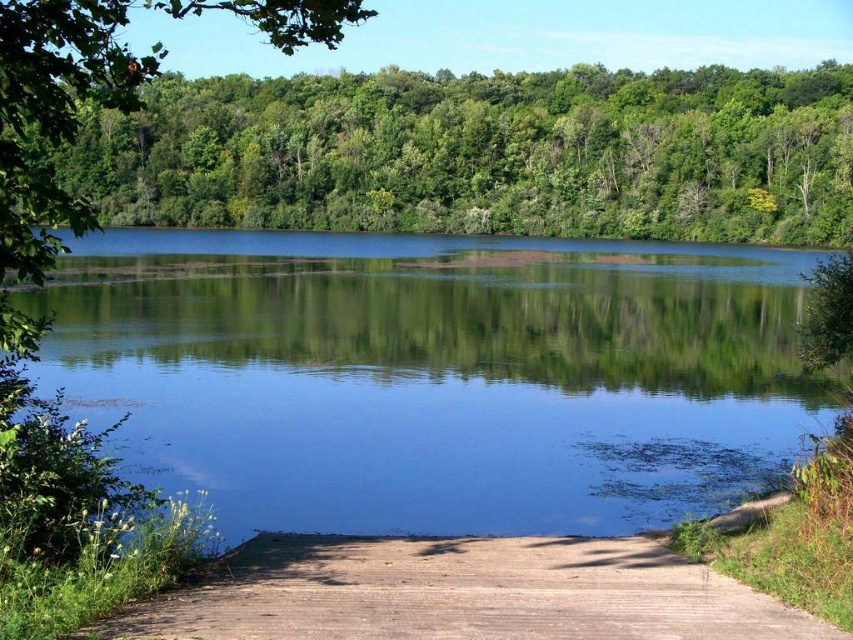
You are standing at the brown wooden path at lower center and want to take a photo of the green leafy trees at upper center. Which direction should you face to ensure the trees are fully visible in your photo?

Since the green leafy trees at upper center are much taller than the brown wooden path at lower center, you should face upwards to ensure the trees are fully visible in your photo.

You are standing at the edge of the lake and want to take a photo of the green leafy trees at upper center and the brown wooden path at lower center. Which object should you zoom in on to capture more details of its features?

You should zoom in on the green leafy trees at upper center because it is larger in size than the brown wooden path at lower center, allowing for more detailed features to be captured.

You are planning to walk along the brown wooden path at lower center to reach the clear water at center. Considering their widths, which one is wider?

The clear water at center is wider than the brown wooden path at lower center.